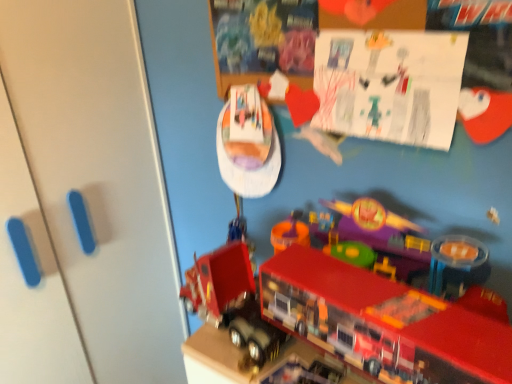
Question: From a real-world perspective, is shiny plastic toy truck at lower center, acting as the 1th toy starting from the bottom, above or below white matte door at left?

Choices:
 (A) above
 (B) below

Answer: (A)

Question: Is point (279, 382) positioned closer to the camera than point (154, 289)?

Choices:
 (A) closer
 (B) farther

Answer: (A)

Question: Estimate the real-world distances between objects in this image. Which object is closer to the shiny plastic toy truck at lower center, acting as the 1th toy starting from the bottom?

Choices:
 (A) shiny plastic fire truck at lower right, marked as the second toy in a top-to-bottom arrangement
 (B) shiny plastic toy boat at upper center, positioned as the 1th toy in top-to-bottom order
 (C) white matte door at left

Answer: (A)

Question: Which of these objects is positioned farthest from the white matte door at left?

Choices:
 (A) shiny plastic fire truck at lower right, marked as the second toy in a top-to-bottom arrangement
 (B) shiny plastic toy boat at upper center, placed as the 3th toy when sorted from bottom to top
 (C) shiny plastic toy truck at lower center, positioned as the third toy in top-to-bottom order

Answer: (C)